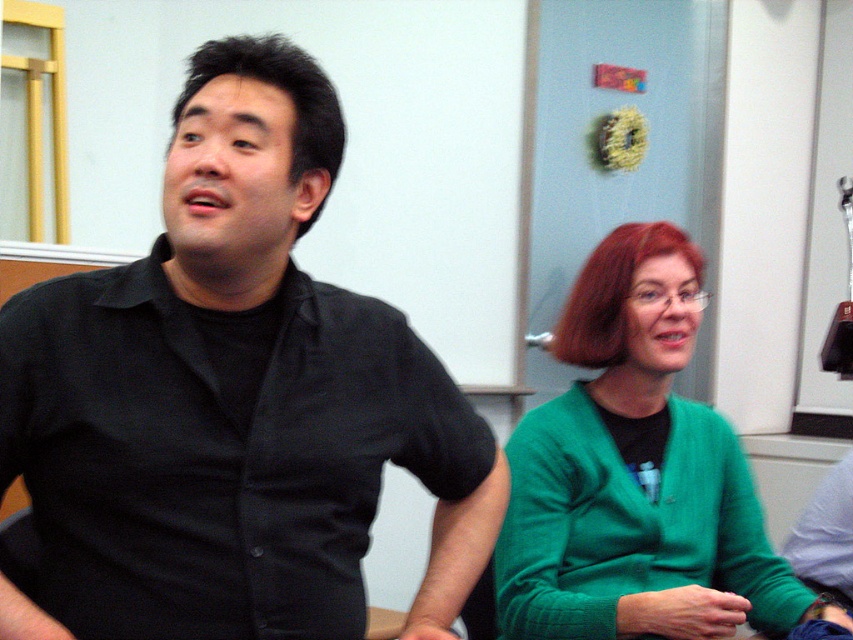
Is black matte shirt at left smaller than green sweater at center?

Yes.

Who is shorter, black matte shirt at left or green sweater at center?

green sweater at center is shorter.

Does point (486, 442) come closer to viewer compared to point (577, 625)?

Yes, it is.

Find the location of a particular element. This screenshot has width=853, height=640. black matte shirt at left is located at coordinates (231, 400).